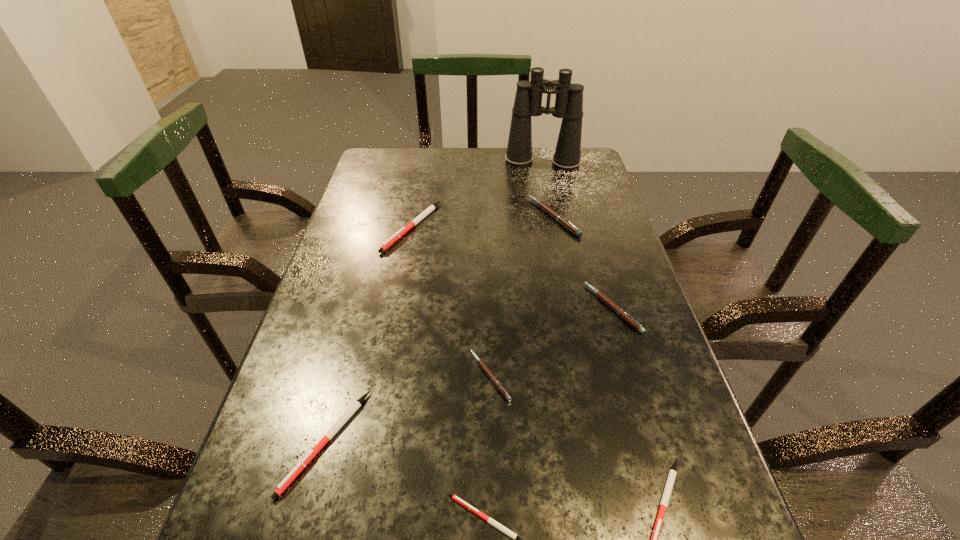
The width and height of the screenshot is (960, 540). I want to click on free region located 0.130m at the nib of the farthest pink pen, so click(x=484, y=217).

This screenshot has height=540, width=960. Identify the location of vacant space situated at the nib of the farthest pink pen. pyautogui.click(x=488, y=217).

I want to click on vacant space located 0.230m at the nib of the farthest pink pen, so click(448, 217).

Image resolution: width=960 pixels, height=540 pixels. What are the coordinates of `vacant region located 0.340m on the clicker of the biggest white pen` in the screenshot? It's located at (386, 366).

Identify the location of vacant region located at the nib of the fifth nearest pen. This screenshot has height=540, width=960. (459, 308).

The height and width of the screenshot is (540, 960). I want to click on free spot located 0.370m at the nib of the fifth nearest pen, so click(x=423, y=308).

The height and width of the screenshot is (540, 960). What are the coordinates of `free region located at the nib of the fifth nearest pen` in the screenshot? It's located at (441, 308).

Locate an element on the screen. vacant space positioned 0.080m at the nib of the leftmost pink pen is located at coordinates (428, 376).

Image resolution: width=960 pixels, height=540 pixels. I want to click on free space located 0.260m at the nib of the leftmost pink pen, so [x=335, y=376].

This screenshot has width=960, height=540. I want to click on vacant region located at the nib of the leftmost pink pen, so click(x=381, y=376).